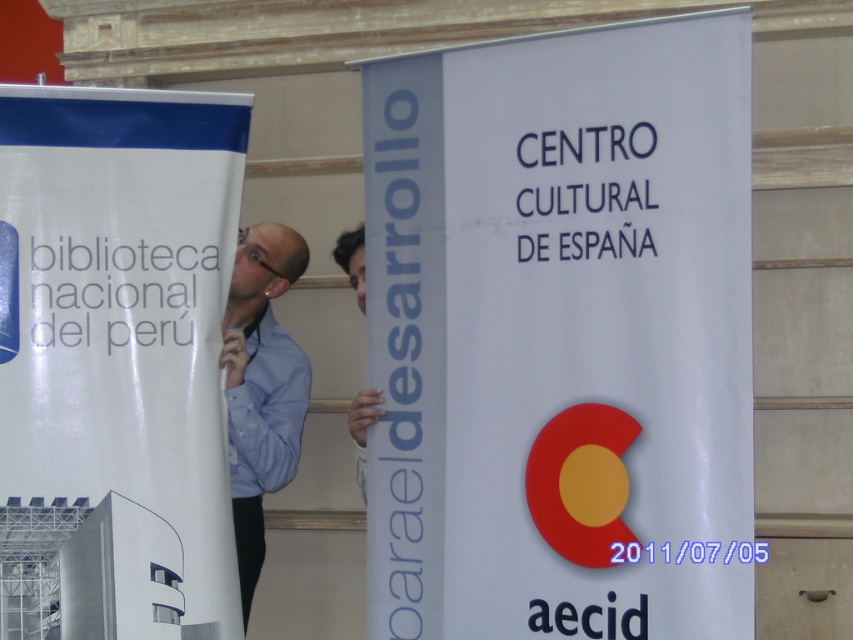
You are standing at the event venue and want to take a photo of the point at coordinates point (276, 358). The camera you have can focus on objects within 5 meters. Will the point be in focus?

The distance of point (276, 358) from viewer is 6.01 meters, so the camera cannot focus on it since it is beyond the 5 meters range.

You are attending an event and notice two people wearing shirts. One is wearing a light blue cotton shirt at left and the other a matte blue shirt at center. Which shirt is taller?

The light blue cotton shirt at left is taller than the matte blue shirt at center.

Consider the image. You are at an event and want to take a photo of both banners. You notice two points marked on your camera screen corresponding to the two banners. The first point is labeled as point at point [271,358] and the second as point at point [250,378]. According to the scene, which point corresponds to the banner that is closer to you?

Point at point [250,378] corresponds to the banner closer to you because it is in front of point at point [271,358].